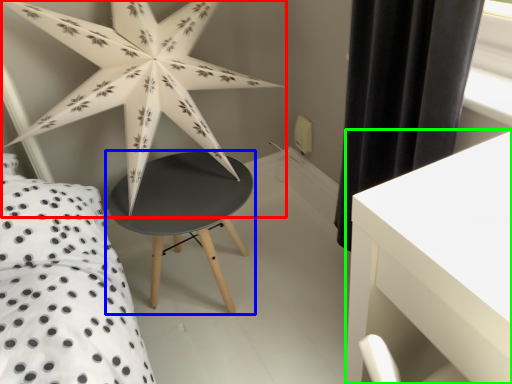
Question: Considering the real-world distances, which object is farthest from star (highlighted by a red box)? table (highlighted by a blue box) or table (highlighted by a green box)?

Choices:
 (A) table
 (B) table

Answer: (B)